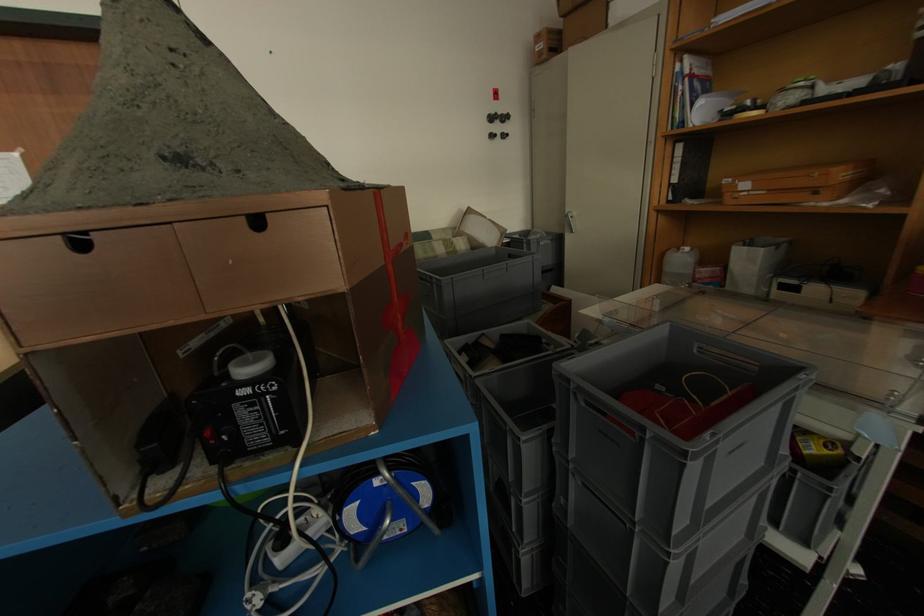
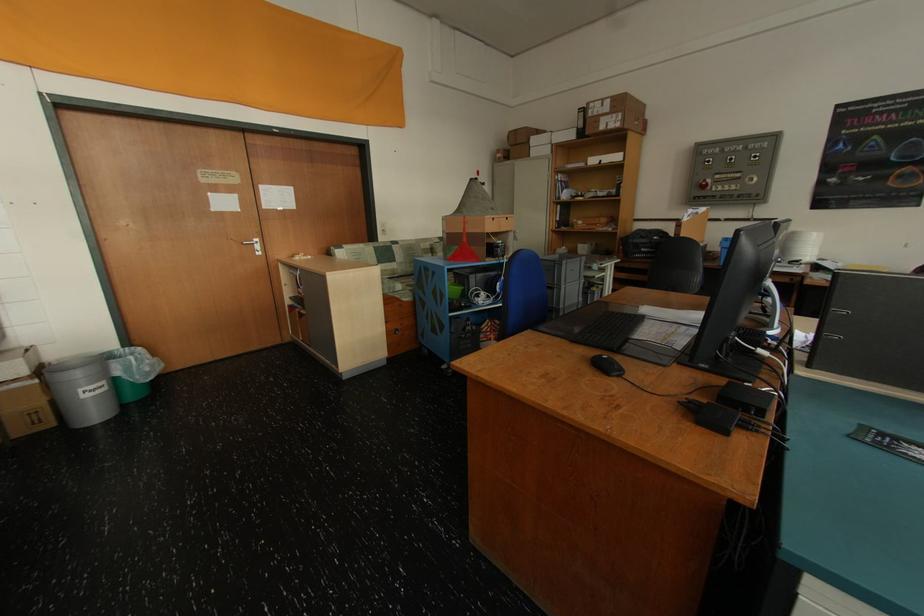
Locate, in the second image, the point that corresponds to pixel 641 525 in the first image.

(563, 286)